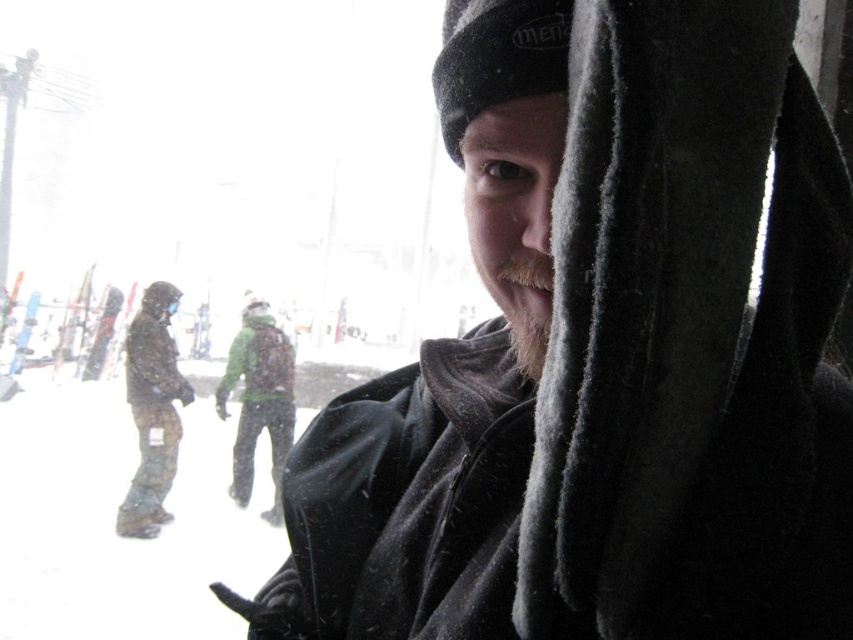
Question: Based on their relative distances, which object is nearer to the beige fuzzy beard at center?

Choices:
 (A) green fabric jacket at center
 (B) fuzzy black scarf at center
 (C) camouflage snow pants at left

Answer: (B)

Question: Among these objects, which one is nearest to the camera?

Choices:
 (A) fuzzy black scarf at center
 (B) camouflage snow pants at left
 (C) beige fuzzy beard at center

Answer: (A)

Question: Is green fabric jacket at center closer to camera compared to beige fuzzy beard at center?

Choices:
 (A) no
 (B) yes

Answer: (A)

Question: Does green fabric jacket at center lie in front of beige fuzzy beard at center?

Choices:
 (A) no
 (B) yes

Answer: (A)

Question: Is fuzzy black scarf at center thinner than beige fuzzy beard at center?

Choices:
 (A) no
 (B) yes

Answer: (A)

Question: Based on their relative distances, which object is farther from the beige fuzzy beard at center?

Choices:
 (A) camouflage-patterned snowboard at center
 (B) fuzzy black scarf at center
 (C) camouflage snow pants at left

Answer: (C)